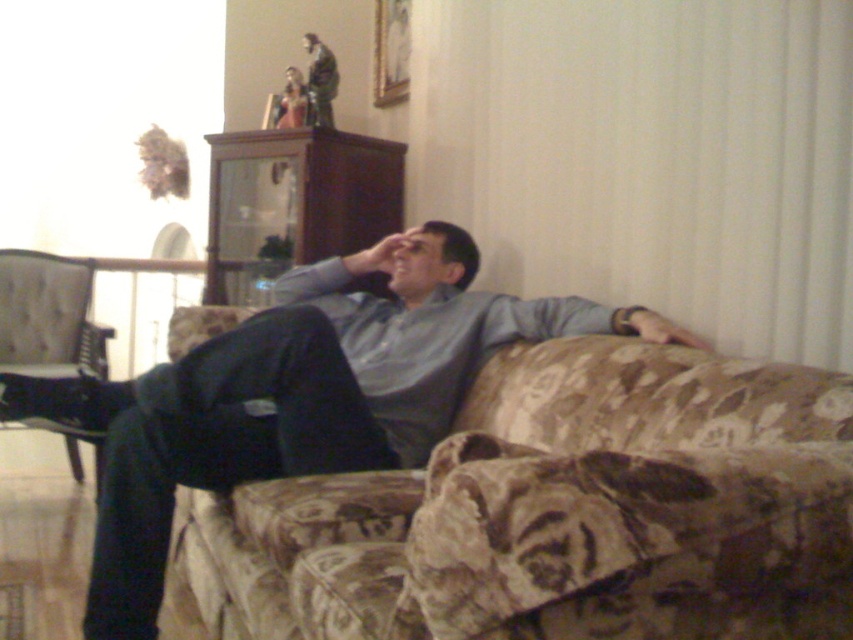
Who is taller, matte gray shirt at center or tufted fabric chair at lower left?

matte gray shirt at center

In the scene shown: Which is more to the left, matte gray shirt at center or tufted fabric chair at lower left?

From the viewer's perspective, tufted fabric chair at lower left appears more on the left side.

Who is more forward, (x=286, y=364) or (x=74, y=368)?

Point (x=286, y=364) is more forward.

Locate an element on the screen. The width and height of the screenshot is (853, 640). matte gray shirt at center is located at coordinates (296, 396).